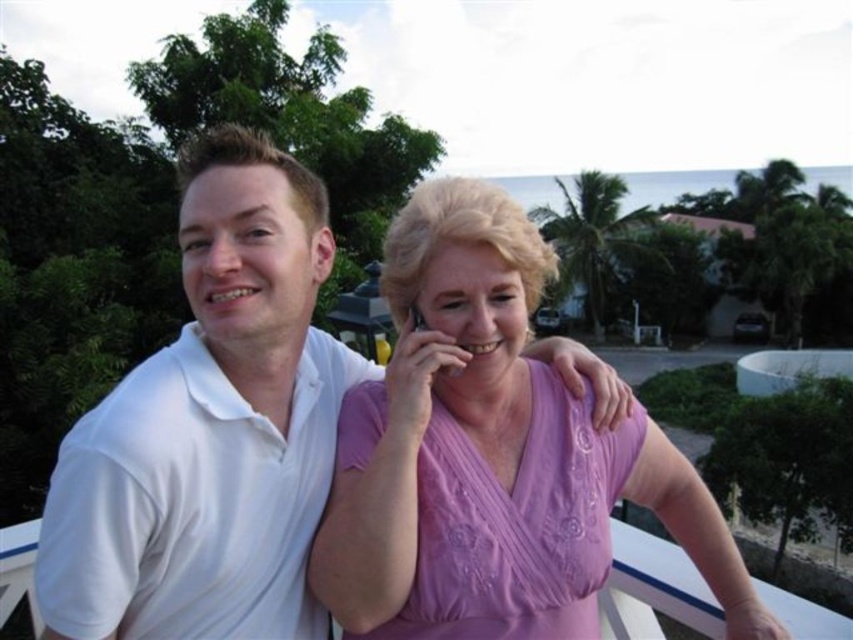
Question: Is white smooth polo shirt at left to the right of pink satin blouse at center from the viewer's perspective?

Choices:
 (A) no
 (B) yes

Answer: (A)

Question: Can you confirm if white smooth polo shirt at left is positioned above pink satin blouse at center?

Choices:
 (A) no
 (B) yes

Answer: (B)

Question: Among these objects, which one is farthest from the camera?

Choices:
 (A) white smooth polo shirt at left
 (B) pink satin blouse at center

Answer: (B)

Question: Which of the following is the closest to the observer?

Choices:
 (A) white smooth polo shirt at left
 (B) pink satin blouse at center

Answer: (A)

Question: Does white smooth polo shirt at left have a smaller size compared to pink satin blouse at center?

Choices:
 (A) yes
 (B) no

Answer: (A)

Question: Among these points, which one is farthest from the camera?

Choices:
 (A) (405, 284)
 (B) (325, 452)

Answer: (B)